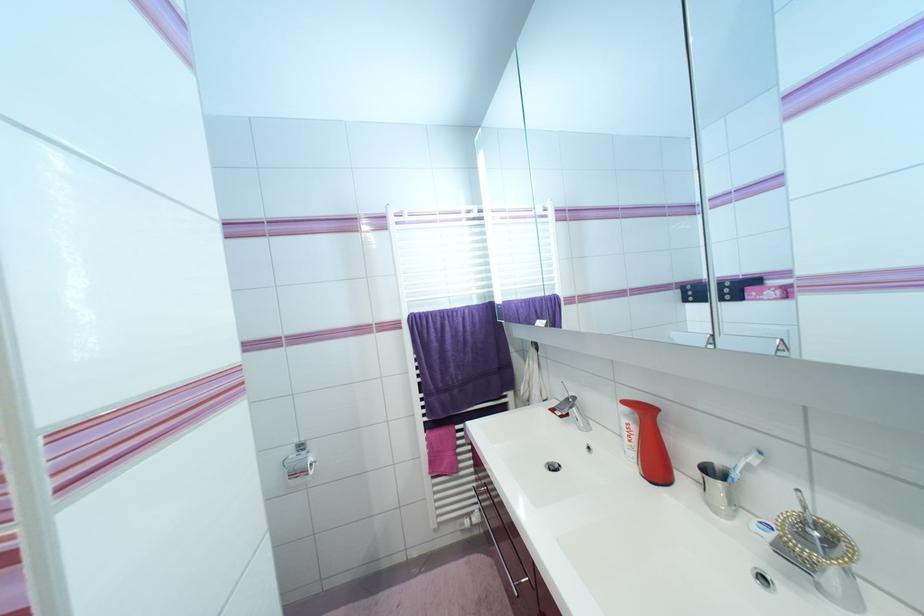
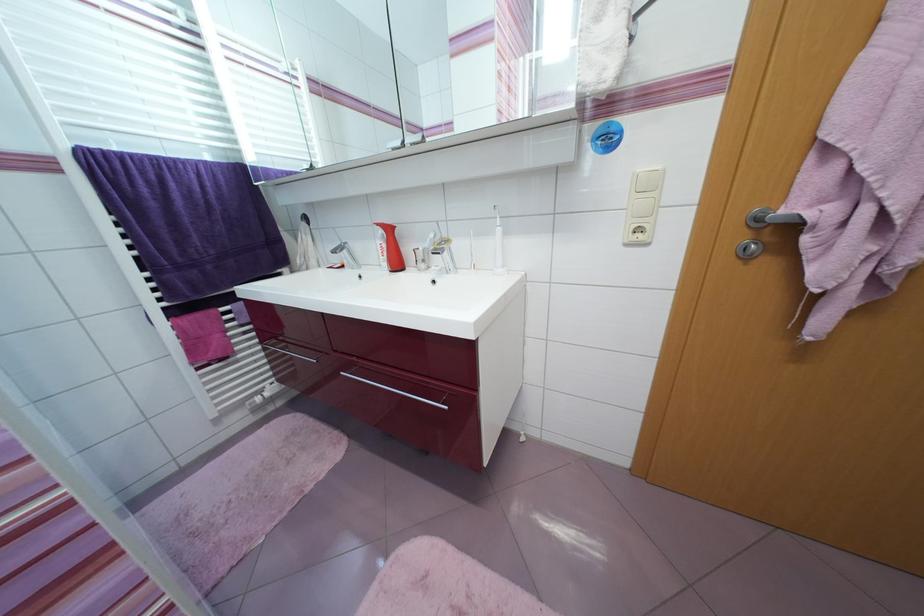
Where in the second image is the point corresponding to the point at 651,414 from the first image?

(394, 231)